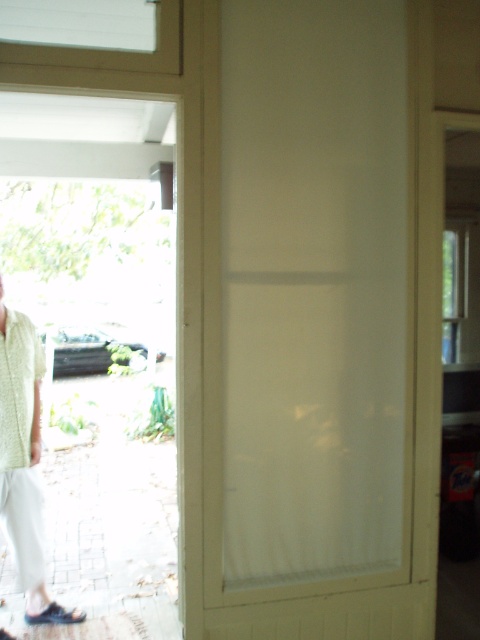
Consider the image. Is white translucent screen door at center taller than white knitted shirt at left?

Correct, white translucent screen door at center is much taller as white knitted shirt at left.

Between point (250, 205) and point (27, 337), which one is positioned behind?

The point (27, 337) is behind.

The height and width of the screenshot is (640, 480). What do you see at coordinates (309, 317) in the screenshot?
I see `white translucent screen door at center` at bounding box center [309, 317].

Find the location of `white translucent screen door at center`. white translucent screen door at center is located at coordinates (309, 317).

Does point (298, 506) come behind point (11, 440)?

That is False.

What do you see at coordinates (309, 317) in the screenshot? I see `white translucent screen door at center` at bounding box center [309, 317].

Locate an element on the screen. Image resolution: width=480 pixels, height=640 pixels. white translucent screen door at center is located at coordinates (309, 317).

Which is more to the right, light green woven shirt at left or white knitted shirt at left?

light green woven shirt at left

Between light green woven shirt at left and white knitted shirt at left, which one is positioned higher?

white knitted shirt at left

What do you see at coordinates (24, 460) in the screenshot? I see `light green woven shirt at left` at bounding box center [24, 460].

Find the location of a particular element. The height and width of the screenshot is (640, 480). light green woven shirt at left is located at coordinates (24, 460).